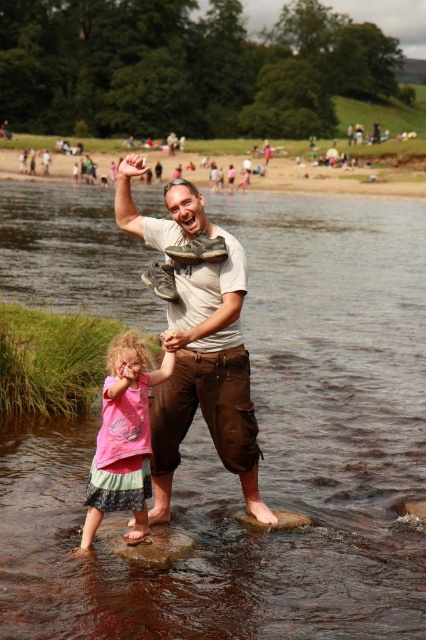
Which is in front, point (296, 195) or point (264, 529)?

Point (264, 529) is more forward.

Does brown smooth rock at center have a smaller size compared to brown smooth rock at lower center?

Incorrect, brown smooth rock at center is not smaller in size than brown smooth rock at lower center.

You are a GUI agent. You are given a task and a screenshot of the screen. Output one action in this format:
    pyautogui.click(x=<x>, y=<y>)
    Task: Click on the brown smooth rock at center
    The height and width of the screenshot is (640, 426).
    Given the screenshot: What is the action you would take?
    pyautogui.click(x=264, y=456)

Which is below, light brown cotton pants at center or pink fabric dress at lower left?

pink fabric dress at lower left is lower down.

Does light brown cotton pants at center have a greater height compared to pink fabric dress at lower left?

Indeed, light brown cotton pants at center has a greater height compared to pink fabric dress at lower left.

Find the location of `light brown cotton pants at center`. light brown cotton pants at center is located at coordinates (198, 346).

Where is `light brown cotton pants at center`? This screenshot has width=426, height=640. light brown cotton pants at center is located at coordinates (198, 346).

Does pink fabric dress at lower left have a lesser height compared to smooth brown rock at center?

Incorrect, pink fabric dress at lower left's height does not fall short of smooth brown rock at center's.

Can you confirm if pink fabric dress at lower left is wider than smooth brown rock at center?

No, pink fabric dress at lower left is not wider than smooth brown rock at center.

Locate an element on the screen. The height and width of the screenshot is (640, 426). pink fabric dress at lower left is located at coordinates (123, 438).